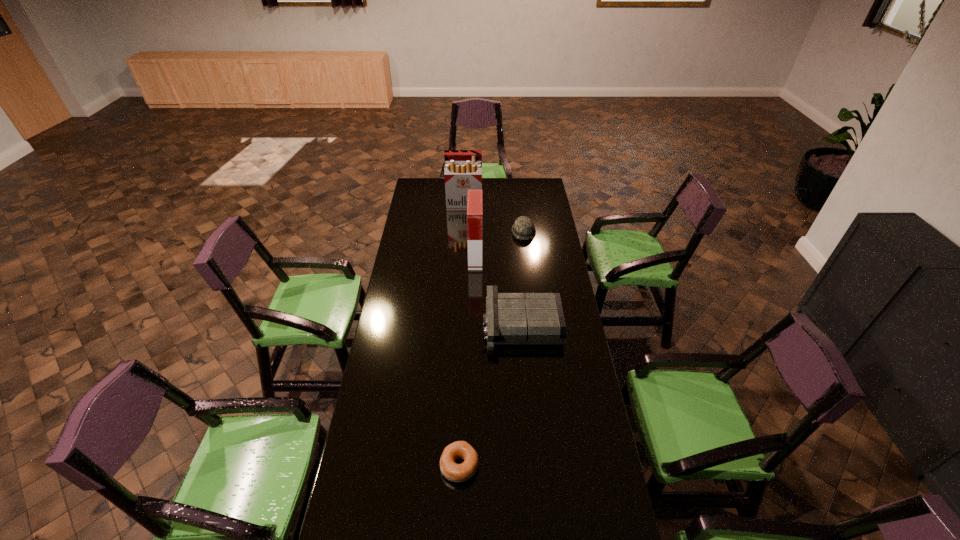
At what (x,y) coordinates should I click in order to perform the action: click on vacant area situated 0.090m on the front panel of the radio receiver. Please return your answer as a coordinate pair (x, y). The width and height of the screenshot is (960, 540). Looking at the image, I should click on (463, 324).

The height and width of the screenshot is (540, 960). I want to click on free region located on the front of the fourth nearest object, so click(531, 291).

Identify the location of vacant space located 0.270m on the back of the bagel. (463, 381).

Identify the location of radio receiver present at the right edge. (511, 318).

You are a GUI agent. You are given a task and a screenshot of the screen. Output one action in this format:
    pyautogui.click(x=<x>, y=<y>)
    Task: Click on the headwear that is at the right edge
    The width and height of the screenshot is (960, 540).
    Given the screenshot: What is the action you would take?
    point(523,228)

The image size is (960, 540). Find the location of `vacant area at the far edge of the desktop`. vacant area at the far edge of the desktop is located at coordinates (511, 194).

Where is `vacant space at the left edge of the desktop`? This screenshot has height=540, width=960. vacant space at the left edge of the desktop is located at coordinates (401, 459).

This screenshot has height=540, width=960. In the image, there is a desktop. Identify the location of free space at the right edge. (585, 369).

Where is `vacant space at the far right corner of the desktop`? The image size is (960, 540). vacant space at the far right corner of the desktop is located at coordinates (538, 188).

Where is `vacant region between the fourth nearest object and the fourth farthest object`? vacant region between the fourth nearest object and the fourth farthest object is located at coordinates (522, 278).